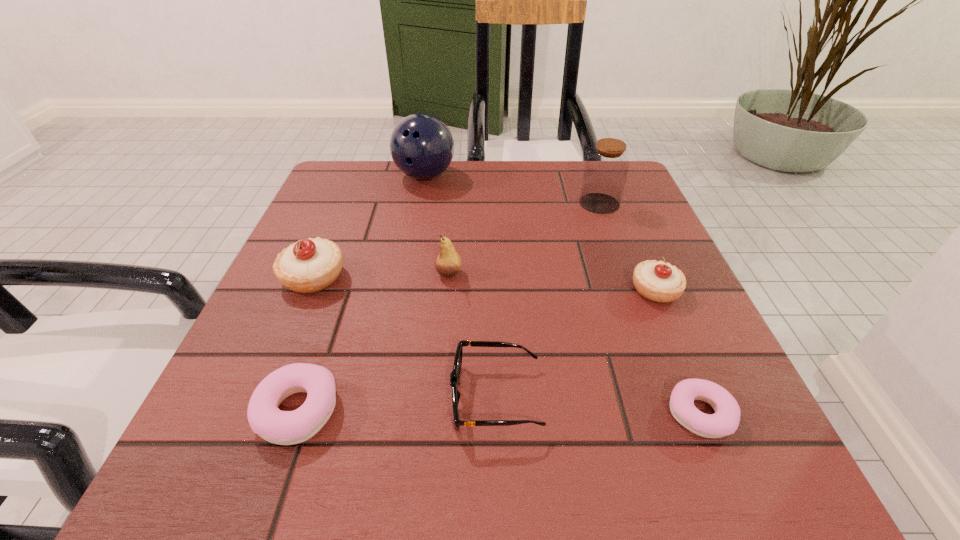
Image resolution: width=960 pixels, height=540 pixels. I want to click on object situated at the near right corner, so click(x=725, y=421).

You are a GUI agent. You are given a task and a screenshot of the screen. Output one action in this format:
    pyautogui.click(x=<x>, y=<y>)
    Task: Click on the vacant region at the far edge of the desktop
    The image size is (960, 540).
    Given the screenshot: What is the action you would take?
    pyautogui.click(x=483, y=194)

The width and height of the screenshot is (960, 540). I want to click on vacant area at the left edge of the desktop, so click(x=341, y=283).

Identify the location of free space at the right edge of the desktop. This screenshot has width=960, height=540. (633, 227).

In the image, there is a desktop. Where is `free space at the near right corner`? free space at the near right corner is located at coordinates (740, 474).

Find the location of `unoccupied area between the shortest pastry and the blue bowling ball`. unoccupied area between the shortest pastry and the blue bowling ball is located at coordinates (563, 295).

This screenshot has height=540, width=960. In order to click on free space between the bowling ball and the fourth tallest object in this screenshot , I will do click(370, 226).

Identify the location of free point between the blue bowling ball and the black sunglasses. This screenshot has height=540, width=960. (461, 287).

What are the coordinates of `free space between the pear and the right pink pastry` in the screenshot? It's located at (575, 343).

This screenshot has width=960, height=540. I want to click on vacant region between the second farthest object and the sunglasses, so click(x=547, y=300).